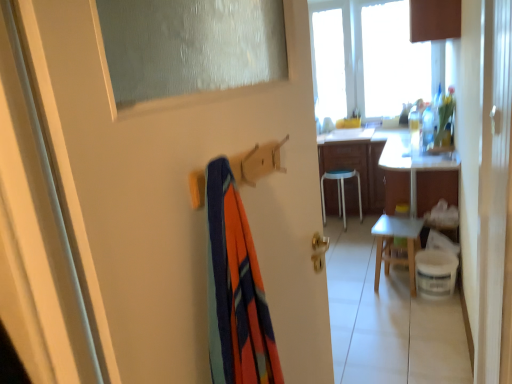
The height and width of the screenshot is (384, 512). In order to click on free space below wooden chair at center (from a real-world perspective) in this screenshot , I will do `click(395, 285)`.